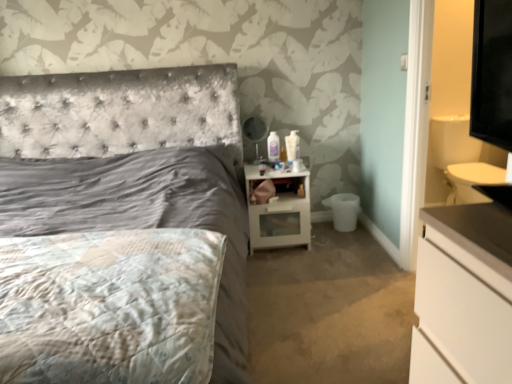
The height and width of the screenshot is (384, 512). Describe the element at coordinates (278, 208) in the screenshot. I see `white glossy nightstand at center` at that location.

This screenshot has width=512, height=384. Describe the element at coordinates (132, 167) in the screenshot. I see `satin gray bed at center` at that location.

Identify the location of fluffy white mattress at lower left. (109, 306).

The width and height of the screenshot is (512, 384). What do you see at coordinates (292, 146) in the screenshot?
I see `white glossy lotion at upper center` at bounding box center [292, 146].

Identify the location of white glossy nightstand at center. (278, 208).

Considering the positions of objects matte black mirror at upper right and white glossy lotion at upper center in the image provided, who is more to the left, matte black mirror at upper right or white glossy lotion at upper center?

matte black mirror at upper right is more to the left.

Considering the sizes of objects matte black mirror at upper right and white glossy lotion at upper center in the image provided, who is shorter, matte black mirror at upper right or white glossy lotion at upper center?

Standing shorter between the two is white glossy lotion at upper center.

How different are the orientations of matte black mirror at upper right and white glossy lotion at upper center in degrees?

10.6 degrees separate the facing orientations of matte black mirror at upper right and white glossy lotion at upper center.

Find the location of a particular element. The image size is (512, 384). toiletry below the matte black mirror at upper right (from the image's perspective) is located at coordinates (292, 146).

From the image's perspective, who appears lower, satin gray bed at center or matte black mirror at upper right?

satin gray bed at center.

Is satin gray bed at center placed right next to matte black mirror at upper right?

satin gray bed at center and matte black mirror at upper right are clearly separated.

Between satin gray bed at center and matte black mirror at upper right, which one has larger width?

satin gray bed at center is wider.

Is satin gray bed at center turned away from matte black mirror at upper right?

No, satin gray bed at center is not facing away from matte black mirror at upper right.

Is satin gray bed at center positioned far away from white glossy lotion at upper center?

Indeed, satin gray bed at center is not near white glossy lotion at upper center.

Is satin gray bed at center to the left of white glossy lotion at upper center from the viewer's perspective?

Correct, you'll find satin gray bed at center to the left of white glossy lotion at upper center.

Looking at their sizes, would you say satin gray bed at center is wider or thinner than white glossy lotion at upper center?

Clearly, satin gray bed at center has more width compared to white glossy lotion at upper center.

Who is taller, satin gray bed at center or white glossy lotion at upper center?

With more height is satin gray bed at center.

In the image, is white glossy lotion at upper center positioned in front of or behind satin gray bed at center?

Clearly, white glossy lotion at upper center is behind satin gray bed at center.

Is white glossy lotion at upper center looking in the opposite direction of satin gray bed at center?

No, satin gray bed at center is not at the back of white glossy lotion at upper center.

From the picture: Considering the positions of objects white glossy lotion at upper center and satin gray bed at center in the image provided, who is more to the left, white glossy lotion at upper center or satin gray bed at center?

satin gray bed at center.

From the image's perspective, which one is positioned higher, fluffy white mattress at lower left or satin gray bed at center?

satin gray bed at center is shown above in the image.

In terms of height, does fluffy white mattress at lower left look taller or shorter compared to satin gray bed at center?

Considering their sizes, fluffy white mattress at lower left has less height than satin gray bed at center.

Considering the sizes of fluffy white mattress at lower left and satin gray bed at center in the image, is fluffy white mattress at lower left wider or thinner than satin gray bed at center?

fluffy white mattress at lower left is thinner than satin gray bed at center.

How different are the orientations of fluffy white mattress at lower left and satin gray bed at center in degrees?

The angle between the facing direction of fluffy white mattress at lower left and the facing direction of satin gray bed at center is 0.000182 degrees.

In the scene shown: Is fluffy white mattress at lower left facing towards matte black mirror at upper right?

No, fluffy white mattress at lower left is not facing towards matte black mirror at upper right.

Is fluffy white mattress at lower left outside of matte black mirror at upper right?

fluffy white mattress at lower left is positioned outside matte black mirror at upper right.

From a real-world perspective, is fluffy white mattress at lower left over matte black mirror at upper right?

No, from a real-world perspective, fluffy white mattress at lower left is not over matte black mirror at upper right

This screenshot has width=512, height=384. In order to click on mattress on the left of matte black mirror at upper right in this screenshot , I will do `click(109, 306)`.

Is white glossy nightstand at center not near satin gray bed at center?

No, white glossy nightstand at center is not far away from satin gray bed at center.

This screenshot has width=512, height=384. There is a white glossy nightstand at center. Identify the location of bed above it (from a real-world perspective). (132, 167).

Is white glossy nightstand at center not within satin gray bed at center?

Yes, white glossy nightstand at center is not within satin gray bed at center.

Considering the relative positions of white glossy nightstand at center and satin gray bed at center in the image provided, is white glossy nightstand at center behind satin gray bed at center?

Yes.

Locate an element on the screen. This screenshot has height=384, width=512. table lamp positioned vertically above the white glossy lotion at upper center (from a real-world perspective) is located at coordinates (256, 132).

This screenshot has height=384, width=512. I want to click on bed in front of the matte black mirror at upper right, so click(132, 167).

From the image, which object appears to be nearer to white glossy nightstand at center, matte black mirror at upper right or satin gray bed at center?

Based on the image, matte black mirror at upper right appears to be nearer to white glossy nightstand at center.

Estimate the real-world distances between objects in this image. Which object is further from white glossy nightstand at center, matte black mirror at upper right or fluffy white mattress at lower left?

fluffy white mattress at lower left is positioned further to the anchor white glossy nightstand at center.

When comparing their distances from white glossy lotion at upper center, does matte black mirror at upper right or white glossy nightstand at center seem further?

The object further to white glossy lotion at upper center is white glossy nightstand at center.

Looking at the image, which one is located closer to fluffy white mattress at lower left, white glossy nightstand at center or matte black mirror at upper right?

The object closer to fluffy white mattress at lower left is white glossy nightstand at center.

Looking at this image, considering their positions, is fluffy white mattress at lower left positioned further to white glossy nightstand at center than satin gray bed at center?

Among the two, fluffy white mattress at lower left is located further to white glossy nightstand at center.

Based on their spatial positions, is satin gray bed at center or white glossy lotion at upper center closer to matte black mirror at upper right?

Among the two, white glossy lotion at upper center is located nearer to matte black mirror at upper right.

From the image, which object appears to be farther from white glossy nightstand at center, fluffy white mattress at lower left or white glossy lotion at upper center?

fluffy white mattress at lower left is positioned further to the anchor white glossy nightstand at center.

Estimate the real-world distances between objects in this image. Which object is closer to fluffy white mattress at lower left, matte black mirror at upper right or satin gray bed at center?

Based on the image, satin gray bed at center appears to be nearer to fluffy white mattress at lower left.

Where is `mattress between satin gray bed at center and matte black mirror at upper right in the front-back direction`? This screenshot has height=384, width=512. mattress between satin gray bed at center and matte black mirror at upper right in the front-back direction is located at coordinates (109, 306).

Image resolution: width=512 pixels, height=384 pixels. What are the coordinates of `nightstand between fluffy white mattress at lower left and white glossy lotion at upper center in the front-back direction` in the screenshot? It's located at (278, 208).

Locate an element on the screen. This screenshot has width=512, height=384. nightstand between satin gray bed at center and matte black mirror at upper right from front to back is located at coordinates (278, 208).

Locate an element on the screen. mattress located between satin gray bed at center and white glossy nightstand at center in the depth direction is located at coordinates (109, 306).